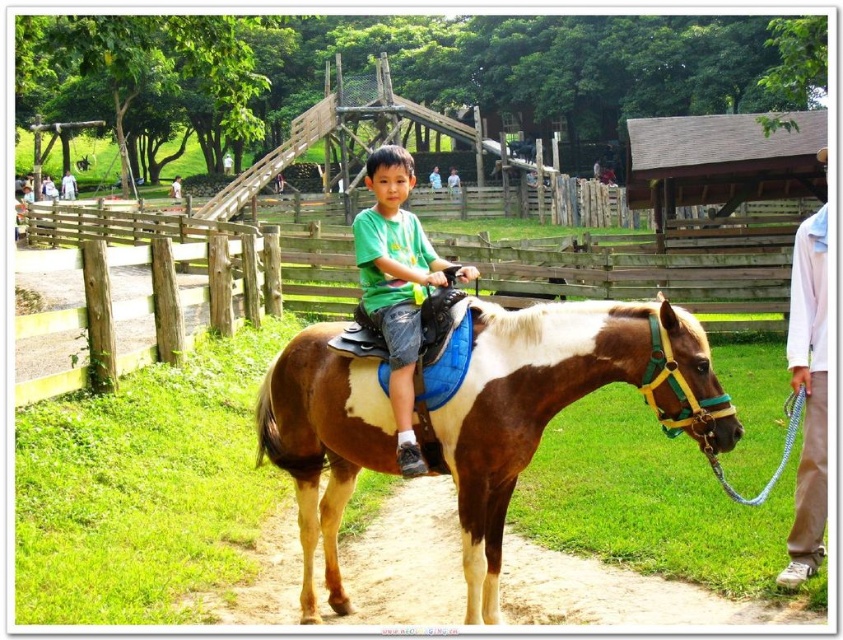
Looking at this image, you are a photographer trying to capture a photo of the brown glossy horse at center and the wooden fence at center. Based on their sizes in the image, which one should you focus on first to ensure they are both in frame?

The brown glossy horse at center is smaller than the wooden fence at center, so you should focus on the wooden fence at center first to ensure both are in frame since it takes up more space.

Based on the scene description, where is the wooden fence at center located in the image?

The wooden fence at center is located at point (636, 266) in the image.